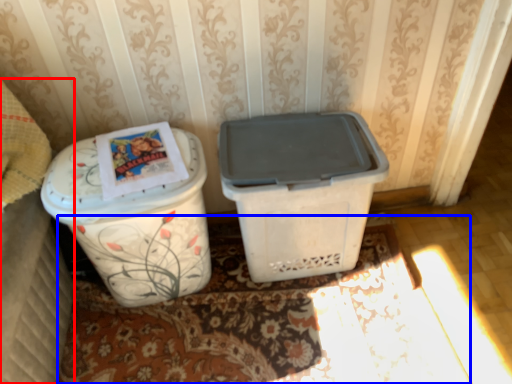
Question: Which of the following is the closest to the observer, leftover (highlighted by a red box) or doormat (highlighted by a blue box)?

Choices:
 (A) leftover
 (B) doormat

Answer: (A)